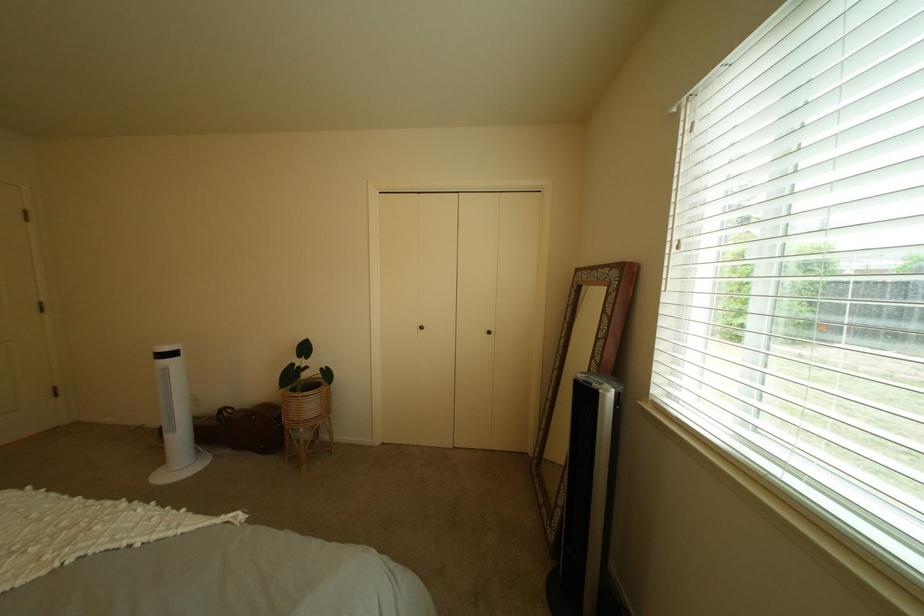
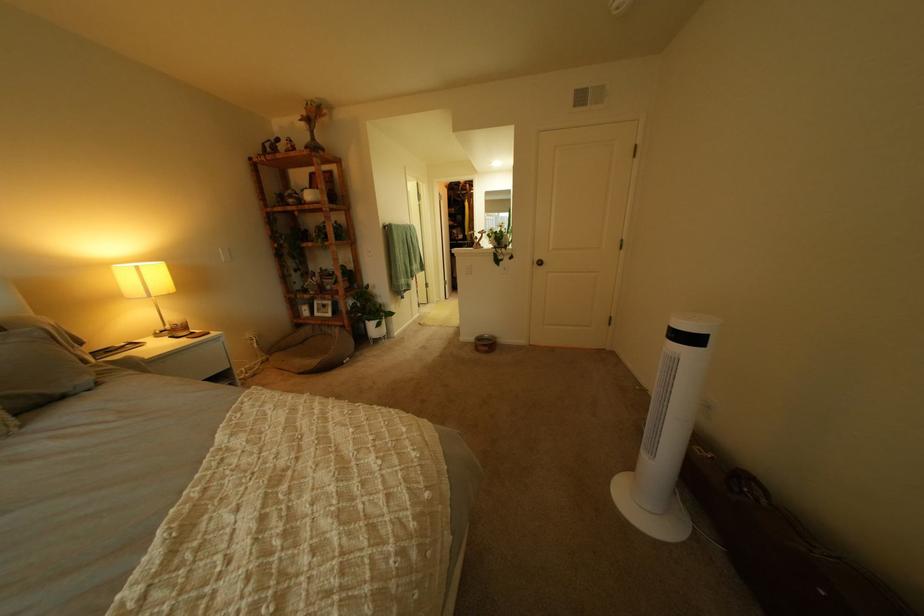
Find the pixel in the second image that matches pixel 188 355 in the first image.

(710, 341)